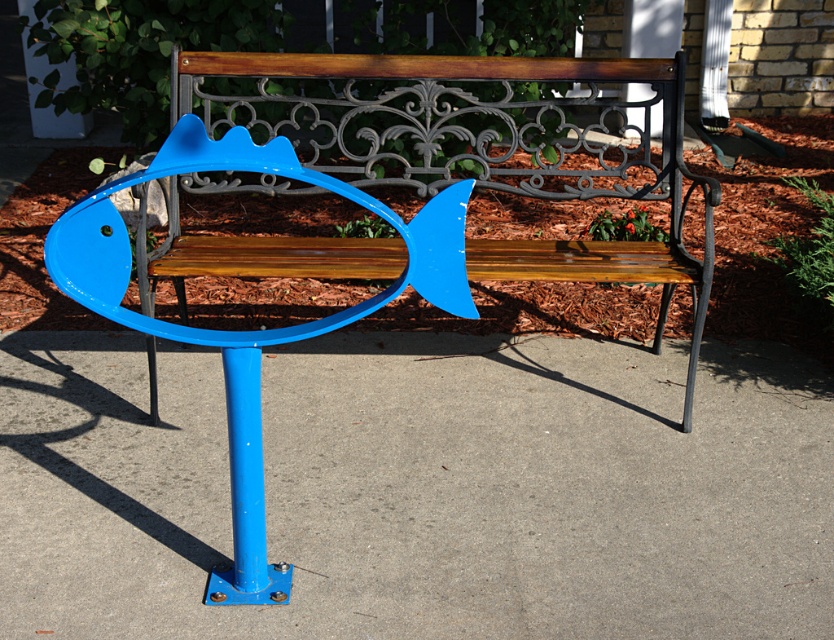
Is blue metal pole at center to the right of blue painted metal fish at center from the viewer's perspective?

In fact, blue metal pole at center is to the left of blue painted metal fish at center.

Who is positioned more to the right, blue metal pole at center or blue painted metal fish at center?

Positioned to the right is blue painted metal fish at center.

At what (x,y) coordinates should I click in order to perform the action: click on blue metal pole at center. Please return your answer as a coordinate pair (x, y). Looking at the image, I should click on (421, 488).